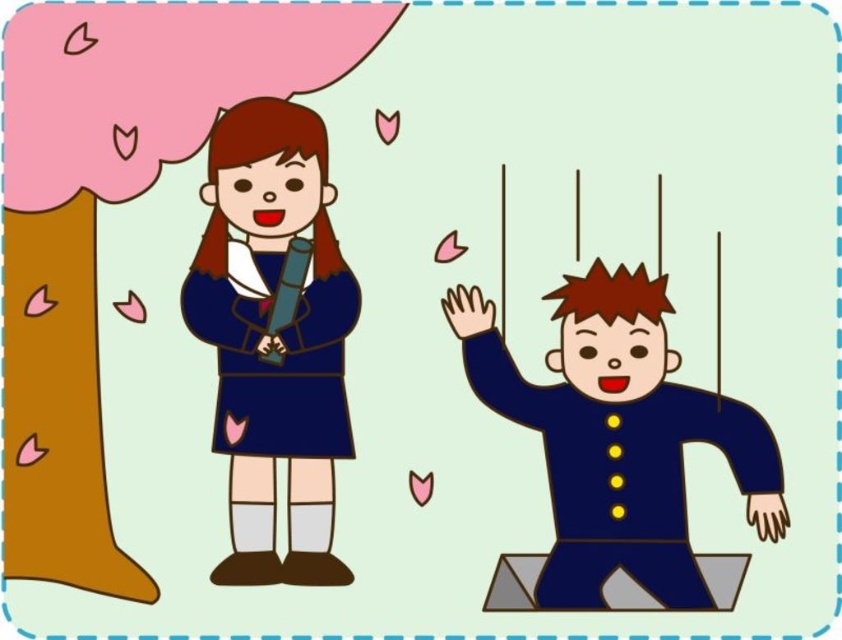
Can you confirm if matte blue dress at center is thinner than matte blue uniform at right?

Correct, matte blue dress at center's width is less than matte blue uniform at right's.

Between point (254, 438) and point (606, 484), which one is positioned in front?

Positioned in front is point (606, 484).

This screenshot has width=842, height=640. I want to click on matte blue dress at center, so click(274, 337).